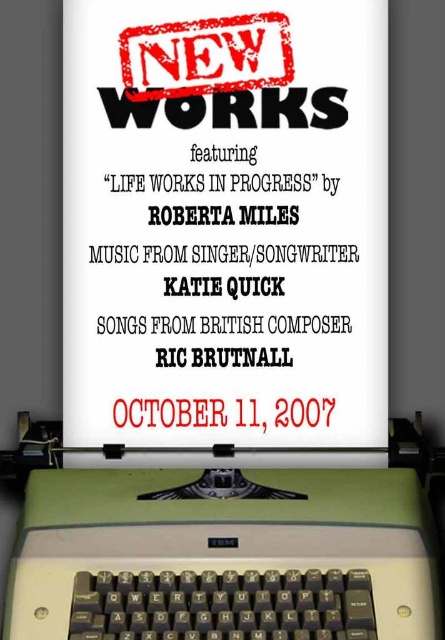
You are organizing a desk and need to place both the white paper at center and the green plastic typewriter at bottom. According to the image, which object is positioned to the right side?

The green plastic typewriter at bottom is positioned to the right of the white paper at center.

You are designing a poster and need to know the dimensions of the objects in the image. Which object is taller between the white paper at center and the green plastic typewriter at bottom?

The white paper at center is much taller than the green plastic typewriter at bottom.